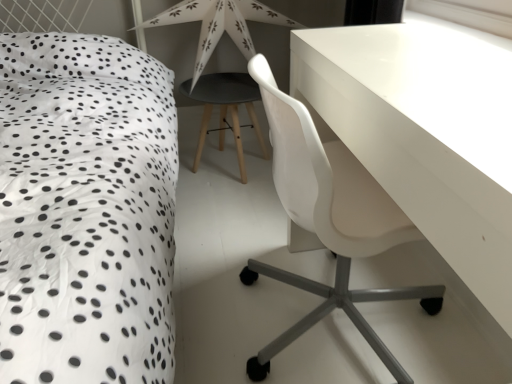
Question: Is matte black stool at center next to transparent plastic window screen at upper right?

Choices:
 (A) no
 (B) yes

Answer: (A)

Question: Is matte black stool at center thinner than transparent plastic window screen at upper right?

Choices:
 (A) yes
 (B) no

Answer: (B)

Question: Does matte black stool at center have a greater height compared to transparent plastic window screen at upper right?

Choices:
 (A) yes
 (B) no

Answer: (A)

Question: Is matte black stool at center wider than transparent plastic window screen at upper right?

Choices:
 (A) yes
 (B) no

Answer: (A)

Question: From a real-world perspective, is matte black stool at center located beneath transparent plastic window screen at upper right?

Choices:
 (A) yes
 (B) no

Answer: (A)

Question: From a real-world perspective, is white dotted fabric at left positioned above or below white paper star at upper center?

Choices:
 (A) below
 (B) above

Answer: (A)

Question: From the image's perspective, is white dotted fabric at left positioned above or below white paper star at upper center?

Choices:
 (A) above
 (B) below

Answer: (B)

Question: In the image, is white dotted fabric at left on the left side or the right side of white paper star at upper center?

Choices:
 (A) left
 (B) right

Answer: (A)

Question: Is white dotted fabric at left taller or shorter than white paper star at upper center?

Choices:
 (A) tall
 (B) short

Answer: (A)

Question: Based on their positions, is white glossy table at upper right located to the left or right of white dotted fabric at left?

Choices:
 (A) right
 (B) left

Answer: (A)

Question: From their relative heights in the image, would you say white glossy table at upper right is taller or shorter than white dotted fabric at left?

Choices:
 (A) tall
 (B) short

Answer: (B)

Question: Is white glossy table at upper right bigger or smaller than white dotted fabric at left?

Choices:
 (A) small
 (B) big

Answer: (A)

Question: Is point (382, 39) closer or farther from the camera than point (23, 114)?

Choices:
 (A) closer
 (B) farther

Answer: (A)

Question: Is white paper star at upper center in front of or behind transparent plastic window screen at upper right in the image?

Choices:
 (A) behind
 (B) front

Answer: (A)

Question: From their relative heights in the image, would you say white paper star at upper center is taller or shorter than transparent plastic window screen at upper right?

Choices:
 (A) short
 (B) tall

Answer: (B)